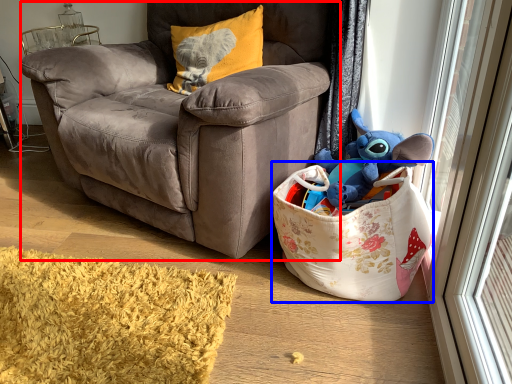
Question: Among these objects, which one is farthest to the camera, chair (highlighted by a red box) or gift basket (highlighted by a blue box)?

Choices:
 (A) chair
 (B) gift basket

Answer: (B)